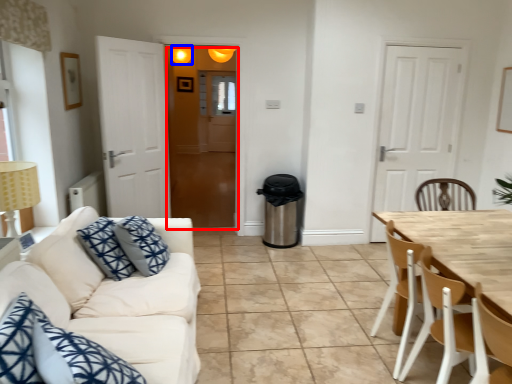
Question: Which object is closer to the camera taking this photo, glass door (highlighted by a red box) or light fixture (highlighted by a blue box)?

Choices:
 (A) glass door
 (B) light fixture

Answer: (A)